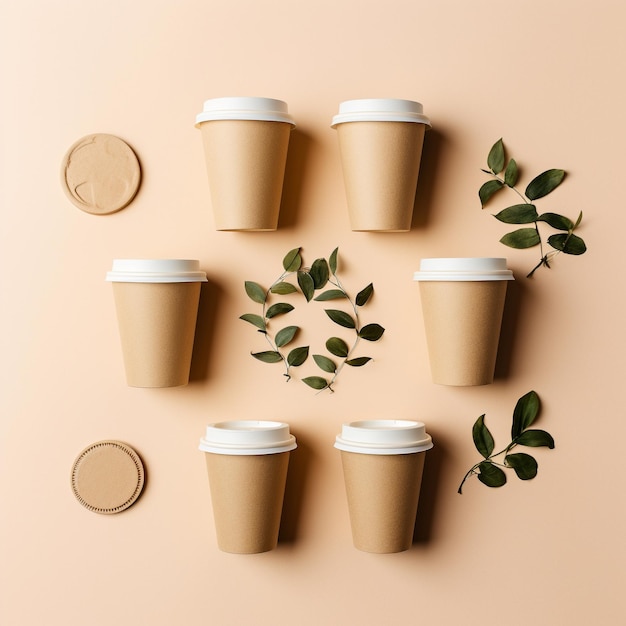
You are a GUI agent. You are given a task and a screenshot of the screen. Output one action in this format:
    pyautogui.click(x=<x>, y=<y>)
    Task: Click on the cups near a lid
    The image size is (626, 626).
    Given the screenshot: What is the action you would take?
    pyautogui.click(x=133, y=331), pyautogui.click(x=250, y=481), pyautogui.click(x=374, y=444), pyautogui.click(x=375, y=172), pyautogui.click(x=231, y=187), pyautogui.click(x=469, y=344)